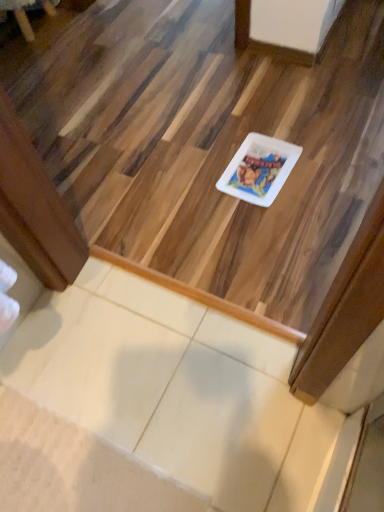
Question: From a real-world perspective, is white glossy plate at center beneath white glossy plate at center?

Choices:
 (A) yes
 (B) no

Answer: (A)

Question: Does white glossy plate at center have a smaller size compared to white glossy plate at center?

Choices:
 (A) no
 (B) yes

Answer: (B)

Question: From the image's perspective, is white glossy plate at center above white glossy plate at center?

Choices:
 (A) yes
 (B) no

Answer: (B)

Question: Does white glossy plate at center contain white glossy plate at center?

Choices:
 (A) no
 (B) yes

Answer: (A)

Question: Is white glossy plate at center facing towards white glossy plate at center?

Choices:
 (A) no
 (B) yes

Answer: (B)

Question: From a real-world perspective, is white glossy plate at center physically located above or below brushed metal table at upper left?

Choices:
 (A) above
 (B) below

Answer: (B)

Question: Is point (117, 57) closer or farther from the camera than point (49, 10)?

Choices:
 (A) closer
 (B) farther

Answer: (A)

Question: Considering the positions of white glossy plate at center and brushed metal table at upper left in the image, is white glossy plate at center taller or shorter than brushed metal table at upper left?

Choices:
 (A) tall
 (B) short

Answer: (B)

Question: Relative to brushed metal table at upper left, is white glossy plate at center in front or behind?

Choices:
 (A) behind
 (B) front

Answer: (B)

Question: Is brushed metal table at upper left inside the boundaries of white glossy plate at center, or outside?

Choices:
 (A) inside
 (B) outside

Answer: (B)

Question: Is point (29, 6) positioned closer to the camera than point (173, 9)?

Choices:
 (A) farther
 (B) closer

Answer: (B)

Question: From a real-world perspective, is brushed metal table at upper left above or below white glossy plate at center?

Choices:
 (A) below
 (B) above

Answer: (B)

Question: From the image's perspective, relative to white glossy plate at center, is brushed metal table at upper left above or below?

Choices:
 (A) below
 (B) above

Answer: (B)

Question: From a real-world perspective, relative to white glossy plate at center, is white glossy plate at center vertically above or below?

Choices:
 (A) below
 (B) above

Answer: (A)

Question: Does point (258, 137) appear closer or farther from the camera than point (324, 172)?

Choices:
 (A) farther
 (B) closer

Answer: (A)